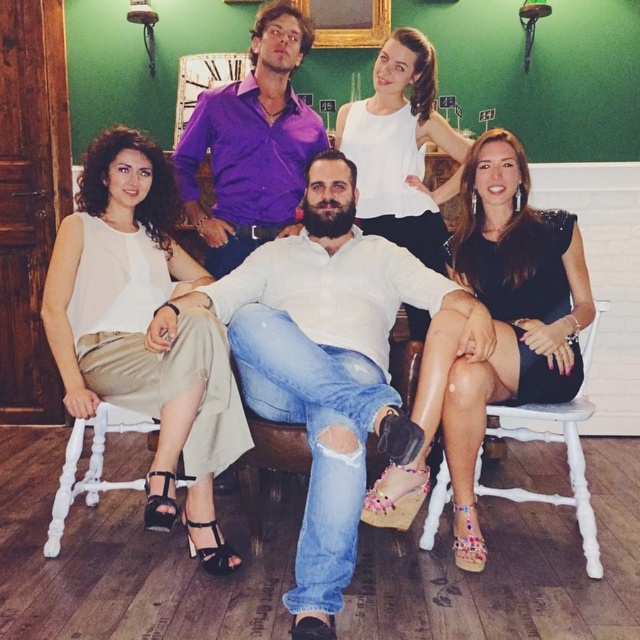
Is black satin dress at lower right closer to camera compared to purple satin shirt at upper center?

That is True.

Find the location of `black satin dress at lower right`. black satin dress at lower right is located at coordinates (502, 308).

Is the position of white matte top at upper center more distant than that of black leather sandal at lower left?

Yes, white matte top at upper center is behind black leather sandal at lower left.

Who is more forward, (444, 225) or (218, 554)?

Point (218, 554)

Find the location of `white matte top at upper center`. white matte top at upper center is located at coordinates (401, 148).

Which is below, purple satin shirt at upper center or black patent leather sandal at lower left?

black patent leather sandal at lower left is below.

Which of these two, purple satin shirt at upper center or black patent leather sandal at lower left, stands shorter?

black patent leather sandal at lower left is shorter.

Who is more forward, (x=237, y=84) or (x=156, y=506)?

Positioned in front is point (x=156, y=506).

Where is `purple satin shirt at upper center`? The image size is (640, 640). purple satin shirt at upper center is located at coordinates (252, 145).